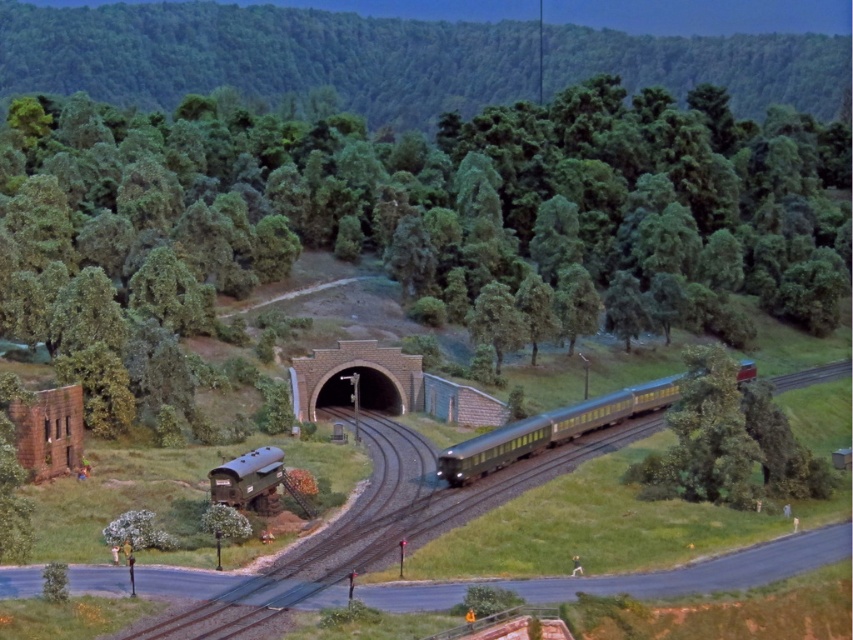
You are an observer standing at the edge of the model railway scene. You notice a metallic green train at center and a green matte tree at center. Which object is positioned higher in the scene?

The green matte tree at center is above the metallic green train at center, so it is positioned higher in the scene.

You are a model train operator trying to navigate the train through the tunnel. You notice two points marked on your map at coordinates point (799,310) and point (282,467). Which point is closer to the tunnel entrance?

Point (799,310) is further to the viewer than point (282,467), so the closer point to the tunnel entrance is point (282,467).

You are a model train enthusiast examining the railway scene. You notice the green matte tree at center and want to place a new decorative element exactly 0.2 units to the right of it. What are the coordinates where you should place this new element?

The green matte tree at center is located at point (x=440, y=208). Adding 0.2 units to the x coordinate gives 0.525, so the new element should be placed at coordinates (x=440, y=336).